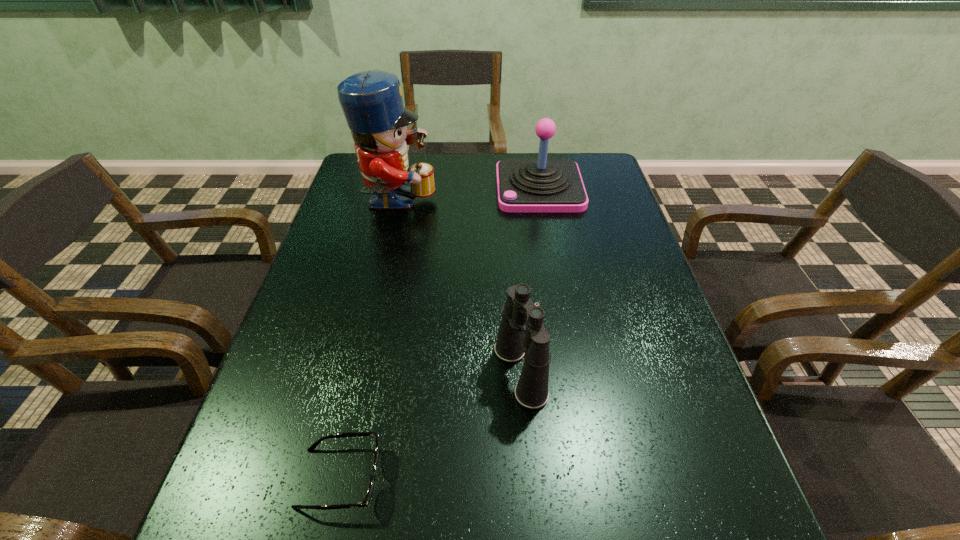
This screenshot has width=960, height=540. What are the coordinates of `free area in between the joystick and the shortest object` in the screenshot? It's located at (440, 333).

Find the location of a particular element. free spot between the tallest object and the joystick is located at coordinates (468, 196).

Find the location of a particular element. object that is the closest one to the tallest object is located at coordinates (542, 185).

At what (x,y) coordinates should I click in order to perform the action: click on the second closest object to the joystick. Please return your answer as a coordinate pair (x, y). Looking at the image, I should click on (x=522, y=333).

In order to click on blank area in the image that satisfies the following two spatial constraints: 1. on the front-facing side of the binoculars; 2. on the left side of the nutcracker in this screenshot , I will do tap(359, 372).

Find the location of a particular element. Image resolution: width=960 pixels, height=540 pixels. vacant space that satisfies the following two spatial constraints: 1. on the front-facing side of the binoculars; 2. on the left side of the nutcracker is located at coordinates (359, 372).

Identify the location of free point that satisfies the following two spatial constraints: 1. on the front-facing side of the nutcracker; 2. on the left side of the third farthest object. This screenshot has width=960, height=540. (359, 372).

At what (x,y) coordinates should I click in order to perform the action: click on vacant area in the image that satisfies the following two spatial constraints: 1. on the front-facing side of the second nearest object; 2. on the left side of the nutcracker. Please return your answer as a coordinate pair (x, y). The width and height of the screenshot is (960, 540). Looking at the image, I should click on (359, 372).

Where is `vacant area in the image that satisfies the following two spatial constraints: 1. on the front-facing side of the tallest object; 2. on the left side of the second nearest object`? This screenshot has width=960, height=540. vacant area in the image that satisfies the following two spatial constraints: 1. on the front-facing side of the tallest object; 2. on the left side of the second nearest object is located at coordinates (359, 372).

You are a GUI agent. You are given a task and a screenshot of the screen. Output one action in this format:
    pyautogui.click(x=<x>, y=<y>)
    Task: Click on the vacant space that satisfies the following two spatial constraints: 1. on the back side of the binoculars; 2. on the front-facing side of the tallest object
    The image size is (960, 540).
    Given the screenshot: What is the action you would take?
    pyautogui.click(x=507, y=204)